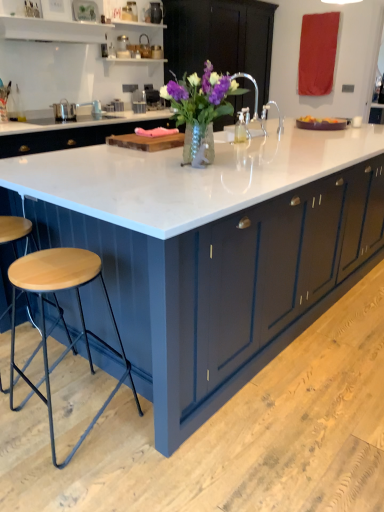
You are a GUI agent. You are given a task and a screenshot of the screen. Output one action in this format:
    pyautogui.click(x=<x>, y=<y>)
    Task: Click on the white marble countertop at center
    The image size is (384, 512).
    Given the screenshot: What is the action you would take?
    pyautogui.click(x=207, y=251)

Where is `wooden cutting board at center`? The width and height of the screenshot is (384, 512). wooden cutting board at center is located at coordinates (146, 141).

The height and width of the screenshot is (512, 384). Identify the location of matte dark blue cabinet at center. (220, 38).

Considering the relative sizes of matte dark blue cabinet at center and translucent glass vase with purple flowers at center in the image provided, is matte dark blue cabinet at center bigger than translucent glass vase with purple flowers at center?

Yes, matte dark blue cabinet at center is bigger than translucent glass vase with purple flowers at center.

From the image's perspective, is matte dark blue cabinet at center positioned above or below translucent glass vase with purple flowers at center?

matte dark blue cabinet at center is situated higher than translucent glass vase with purple flowers at center in the image.

Considering the sizes of objects matte dark blue cabinet at center and translucent glass vase with purple flowers at center in the image provided, who is thinner, matte dark blue cabinet at center or translucent glass vase with purple flowers at center?

translucent glass vase with purple flowers at center is thinner.

From a real-world perspective, is matte dark blue cabinet at center over translucent glass vase with purple flowers at center?

Yes.

Is wooden cutting board at center thinner than wooden seat stool at lower left?

Yes.

Considering the points (169, 145) and (81, 438), which point is behind, point (169, 145) or point (81, 438)?

Point (169, 145)

Does wooden cutting board at center come behind wooden seat stool at lower left?

Yes, it is.

From a real-world perspective, between translucent glass vase with purple flowers at center and wooden cutting board at center, who is vertically lower?

In real-world perspective, wooden cutting board at center is lower.

Looking at this image, is translucent glass vase with purple flowers at center smaller than wooden cutting board at center?

Actually, translucent glass vase with purple flowers at center might be larger than wooden cutting board at center.

Where is `floral arrangement on the right of wooden cutting board at center`? The width and height of the screenshot is (384, 512). floral arrangement on the right of wooden cutting board at center is located at coordinates (200, 106).

Can you tell me how much translucent glass vase with purple flowers at center and wooden cutting board at center differ in facing direction?

The angular difference between translucent glass vase with purple flowers at center and wooden cutting board at center is 27.8 degrees.

The width and height of the screenshot is (384, 512). I want to click on floral arrangement that appears in front of the wooden cutting board at center, so click(200, 106).

Considering the positions of objects wooden cutting board at center and translucent glass vase with purple flowers at center in the image provided, who is more to the right, wooden cutting board at center or translucent glass vase with purple flowers at center?

From the viewer's perspective, translucent glass vase with purple flowers at center appears more on the right side.

Looking at this image, is wooden cutting board at center positioned far away from translucent glass vase with purple flowers at center?

No, there isn't a large distance between wooden cutting board at center and translucent glass vase with purple flowers at center.

Does wooden cutting board at center have a smaller size compared to translucent glass vase with purple flowers at center?

Correct, wooden cutting board at center occupies less space than translucent glass vase with purple flowers at center.

Is translucent glass vase with purple flowers at center far away from matte dark blue cabinet at center?

That's right, there is a large distance between translucent glass vase with purple flowers at center and matte dark blue cabinet at center.

From a real-world perspective, who is located lower, translucent glass vase with purple flowers at center or matte dark blue cabinet at center?

translucent glass vase with purple flowers at center is physically lower.

Which object is further away from the camera, translucent glass vase with purple flowers at center or matte dark blue cabinet at center?

matte dark blue cabinet at center.

Between point (205, 118) and point (230, 4), which one is positioned in front?

The point (205, 118) is closer to the camera.

Is translucent glass vase with purple flowers at center oriented towards white marble countertop at center?

No, translucent glass vase with purple flowers at center is not turned towards white marble countertop at center.

From the image's perspective, which one is positioned lower, translucent glass vase with purple flowers at center or white marble countertop at center?

white marble countertop at center, from the image's perspective.

Consider the image. How many degrees apart are the facing directions of translucent glass vase with purple flowers at center and white marble countertop at center?

They differ by 27.5 degrees in their facing directions.

Is translucent glass vase with purple flowers at center closer to camera compared to white marble countertop at center?

No, translucent glass vase with purple flowers at center is further to the viewer.

Is the position of matte dark blue cabinet at center more distant than that of wooden cutting board at center?

Yes, matte dark blue cabinet at center is further from the viewer.

From the image's perspective, which one is positioned lower, matte dark blue cabinet at center or wooden cutting board at center?

wooden cutting board at center, from the image's perspective.

Where is `cabinetry behind the wooden cutting board at center`? cabinetry behind the wooden cutting board at center is located at coordinates (220, 38).

Is matte dark blue cabinet at center smaller than wooden cutting board at center?

No, matte dark blue cabinet at center is not smaller than wooden cutting board at center.

You are a GUI agent. You are given a task and a screenshot of the screen. Output one action in this format:
    pyautogui.click(x=<x>, y=<y>)
    Task: Click on the cabinetry above the translucent glass vase with purple flowers at center (from a real-world perspective)
    This screenshot has width=384, height=512.
    Given the screenshot: What is the action you would take?
    pyautogui.click(x=220, y=38)

What are the coordinates of `stool on the left of wooden cutting board at center` in the screenshot? It's located at (44, 318).

Which object lies nearer to the anchor point wooden seat stool at lower left, translucent glass vase with purple flowers at center or white marble countertop at center?

white marble countertop at center.

Looking at this image, considering their positions, is wooden seat stool at lower left positioned further to matte dark blue cabinet at center than white marble countertop at center?

wooden seat stool at lower left lies further to matte dark blue cabinet at center than the other object.

Looking at the image, which one is located closer to wooden seat stool at lower left, white marble countertop at center or translucent glass vase with purple flowers at center?

white marble countertop at center is closer to wooden seat stool at lower left.

From the image, which object appears to be nearer to translucent glass vase with purple flowers at center, wooden cutting board at center or white marble countertop at center?

The object closer to translucent glass vase with purple flowers at center is wooden cutting board at center.

When comparing their distances from white marble countertop at center, does matte dark blue cabinet at center or translucent glass vase with purple flowers at center seem closer?

Based on the image, translucent glass vase with purple flowers at center appears to be nearer to white marble countertop at center.

Based on their spatial positions, is white marble countertop at center or wooden seat stool at lower left closer to matte dark blue cabinet at center?

white marble countertop at center.

Based on their spatial positions, is matte dark blue cabinet at center or white marble countertop at center closer to translucent glass vase with purple flowers at center?

Among the two, white marble countertop at center is located nearer to translucent glass vase with purple flowers at center.

When comparing their distances from wooden cutting board at center, does translucent glass vase with purple flowers at center or matte dark blue cabinet at center seem closer?

translucent glass vase with purple flowers at center.

At what (x,y) coordinates should I click in order to perform the action: click on floral arrangement between white marble countertop at center and wooden cutting board at center along the z-axis. Please return your answer as a coordinate pair (x, y). This screenshot has width=384, height=512. Looking at the image, I should click on (200, 106).

Locate an element on the screen. floral arrangement between wooden cutting board at center and wooden seat stool at lower left in the vertical direction is located at coordinates (200, 106).

Image resolution: width=384 pixels, height=512 pixels. What are the coordinates of `floral arrangement positioned between wooden seat stool at lower left and matte dark blue cabinet at center from near to far` in the screenshot? It's located at (200, 106).

Locate an element on the screen. The width and height of the screenshot is (384, 512). wood located between white marble countertop at center and matte dark blue cabinet at center in the depth direction is located at coordinates (146, 141).